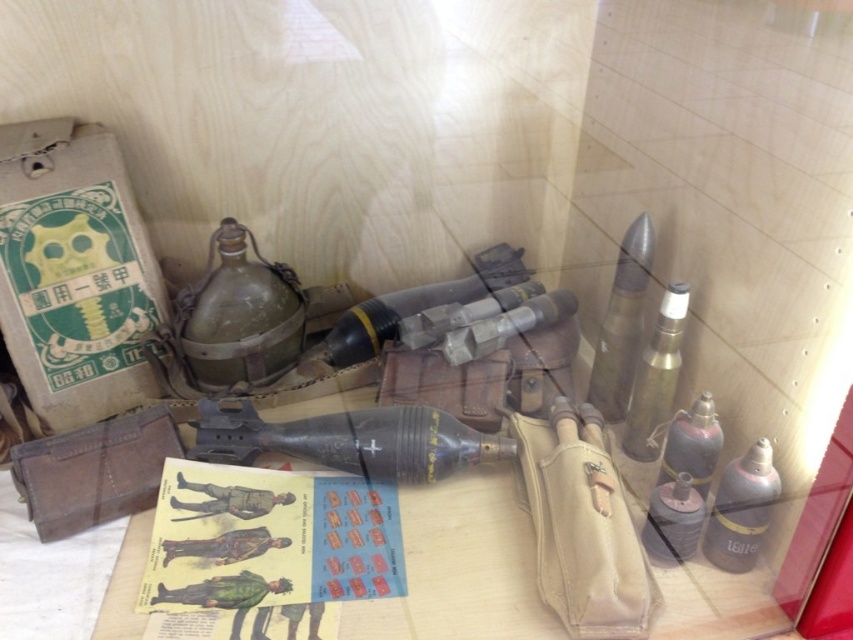
You are a museum curator arranging items in a glass case. You have a matte black bottle at lower right and a metallic silver bottle at upper right. Which bottle is placed to the right of the other?

The matte black bottle at lower right is positioned on the right side of metallic silver bottle at upper right.

You are a museum visitor looking at the glass case. You see the matte black bottle at lower right and the metallic silver bottle at upper right. Which bottle is positioned lower in the display?

The matte black bottle at lower right is positioned lower in the display than the metallic silver bottle at upper right.